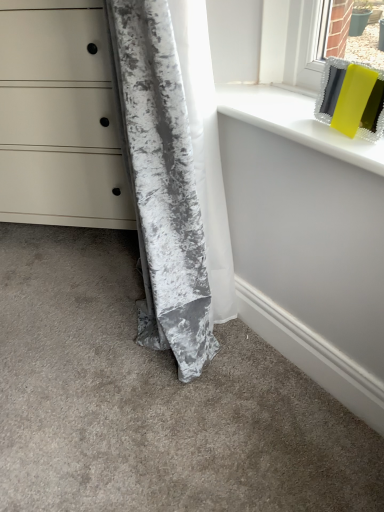
Question: Is matte white chest of drawers at lower left beside crushed velvet curtain at lower left?

Choices:
 (A) no
 (B) yes

Answer: (A)

Question: Can you confirm if matte white chest of drawers at lower left is thinner than crushed velvet curtain at lower left?

Choices:
 (A) yes
 (B) no

Answer: (B)

Question: Is matte white chest of drawers at lower left positioned with its back to crushed velvet curtain at lower left?

Choices:
 (A) no
 (B) yes

Answer: (A)

Question: Is matte white chest of drawers at lower left closer to camera compared to crushed velvet curtain at lower left?

Choices:
 (A) yes
 (B) no

Answer: (B)

Question: From a real-world perspective, is matte white chest of drawers at lower left on top of crushed velvet curtain at lower left?

Choices:
 (A) no
 (B) yes

Answer: (A)

Question: Could you tell me if matte white chest of drawers at lower left is facing crushed velvet curtain at lower left?

Choices:
 (A) no
 (B) yes

Answer: (A)

Question: Is white glossy window sill at upper right facing away from matte white chest of drawers at lower left?

Choices:
 (A) no
 (B) yes

Answer: (A)

Question: Does white glossy window sill at upper right have a greater width compared to matte white chest of drawers at lower left?

Choices:
 (A) no
 (B) yes

Answer: (A)

Question: Is white glossy window sill at upper right not close to matte white chest of drawers at lower left?

Choices:
 (A) yes
 (B) no

Answer: (B)

Question: Does white glossy window sill at upper right have a greater height compared to matte white chest of drawers at lower left?

Choices:
 (A) yes
 (B) no

Answer: (B)

Question: Can you confirm if white glossy window sill at upper right is thinner than matte white chest of drawers at lower left?

Choices:
 (A) yes
 (B) no

Answer: (A)

Question: Is white glossy window sill at upper right located outside matte white chest of drawers at lower left?

Choices:
 (A) no
 (B) yes

Answer: (B)

Question: Does matte white chest of drawers at lower left appear on the left side of white glossy window sill at upper right?

Choices:
 (A) yes
 (B) no

Answer: (A)